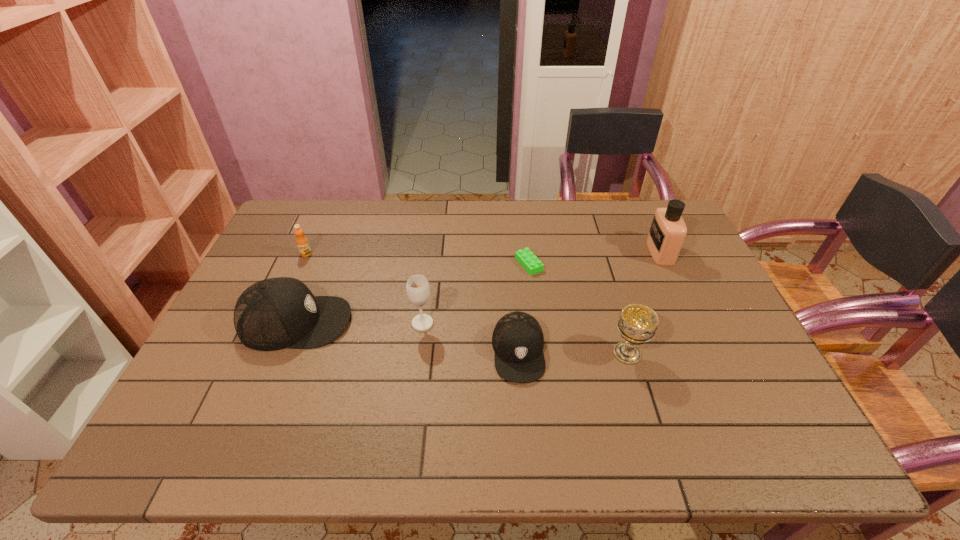
The width and height of the screenshot is (960, 540). I want to click on free area in between the shortest object and the perfume, so click(594, 258).

This screenshot has width=960, height=540. In order to click on vacant space in between the right cap and the wineglass in this screenshot , I will do `click(470, 338)`.

Identify the location of free point between the wineglass and the rightmost object. This screenshot has width=960, height=540. (541, 288).

Where is `vacant area between the Lego and the right cap`? Image resolution: width=960 pixels, height=540 pixels. vacant area between the Lego and the right cap is located at coordinates (523, 308).

The width and height of the screenshot is (960, 540). Identify the location of unoccupied position between the chalice and the Lego. (578, 309).

Select which object is the fifth closest to the chalice. Please provide its 2D coordinates. Your answer should be formatted as a tuple, i.e. [(x, y)], where the tuple contains the x and y coordinates of a point satisfying the conditions above.

[(275, 313)]

At what (x,y) coordinates should I click in order to perform the action: click on the fifth closest object to the fifth object from right to left. Please return your answer as a coordinate pair (x, y). Looking at the image, I should click on (638, 323).

Locate an element on the screen. This screenshot has height=540, width=960. free location that satisfies the following two spatial constraints: 1. on the front-facing side of the left cap; 2. on the right side of the second object from right to left is located at coordinates (283, 353).

You are a GUI agent. You are given a task and a screenshot of the screen. Output one action in this format:
    pyautogui.click(x=<x>, y=<y>)
    Task: Click on the free space that satisfies the following two spatial constraints: 1. on the front label of the rightmost object; 2. on the front side of the wineglass
    The height and width of the screenshot is (540, 960).
    Given the screenshot: What is the action you would take?
    pyautogui.click(x=693, y=323)

I want to click on vacant space that satisfies the following two spatial constraints: 1. on the front-facing side of the taller cap; 2. on the right side of the chalice, so click(283, 353).